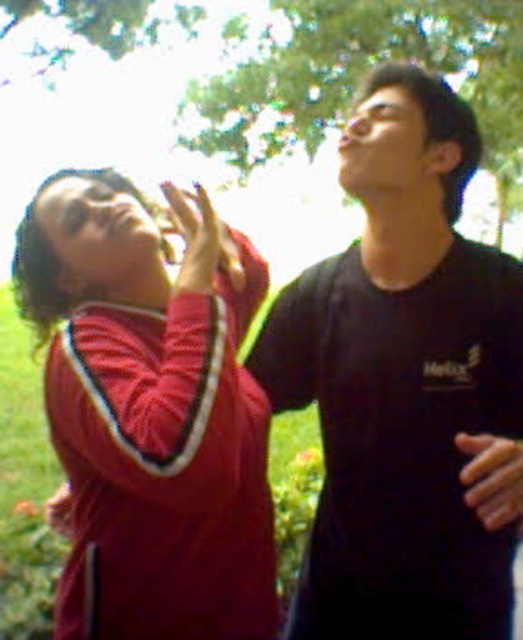
Question: Is black matte shirt at center above green leafy tree at upper center?

Choices:
 (A) no
 (B) yes

Answer: (A)

Question: Which object is positioned closest to the green leafy tree at upper center?

Choices:
 (A) smooth skin hand at lower right
 (B) black matte shirt at center
 (C) matte red jacket at left
 (D) matte red hand at upper left

Answer: (B)

Question: Which is nearer to the matte red hand at upper left?

Choices:
 (A) black matte shirt at center
 (B) smooth skin hand at lower right

Answer: (A)

Question: Is black matte shirt at center further to camera compared to smooth skin hand at lower right?

Choices:
 (A) no
 (B) yes

Answer: (B)

Question: Which point appears closest to the camera in this image?

Choices:
 (A) (452, 636)
 (B) (185, 280)
 (C) (202, 424)
 (D) (519, 138)

Answer: (C)

Question: Does green leafy tree at upper center come behind matte red hand at upper left?

Choices:
 (A) no
 (B) yes

Answer: (B)